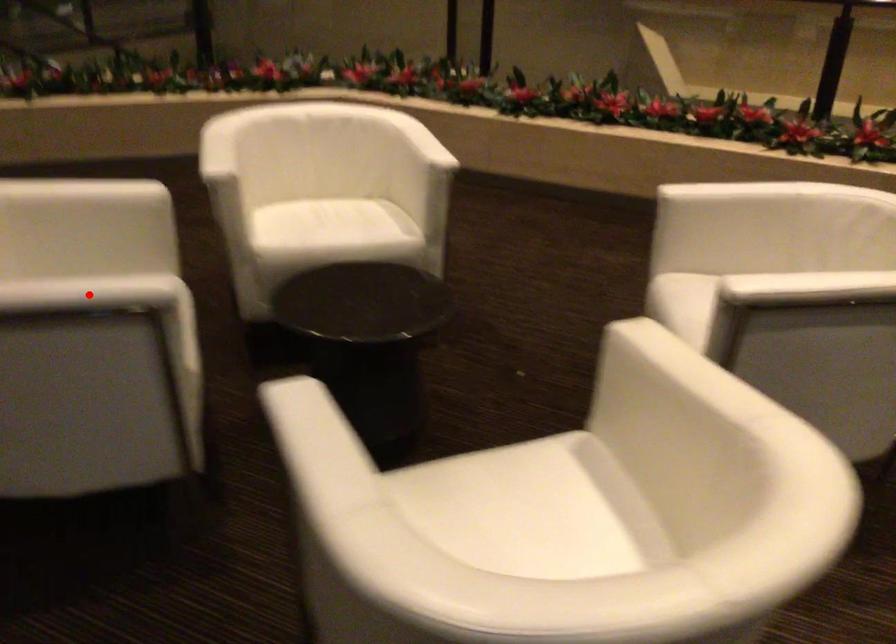
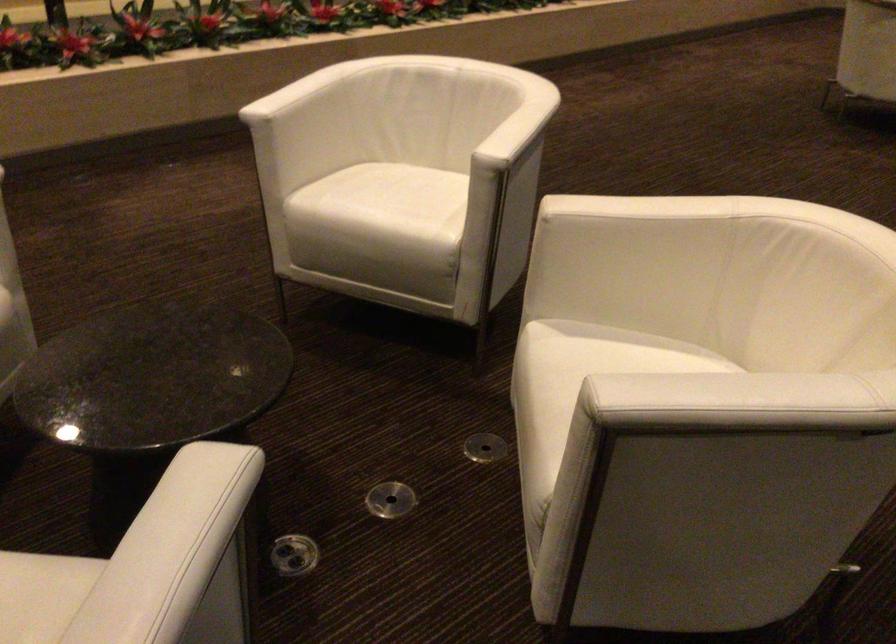
The point at the highlighted location is marked in the first image. Where is the corresponding point in the second image?

(186, 527)